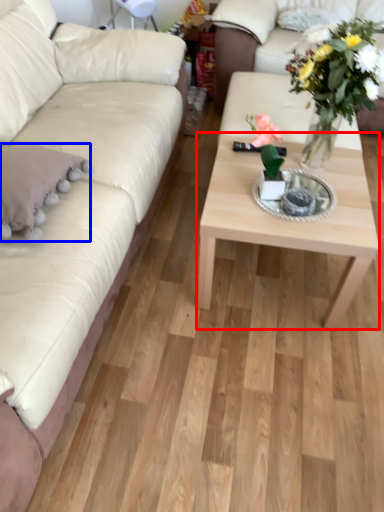
Question: Which of the following is the closest to the observer, coffee table (highlighted by a red box) or pillow (highlighted by a blue box)?

Choices:
 (A) coffee table
 (B) pillow

Answer: (B)